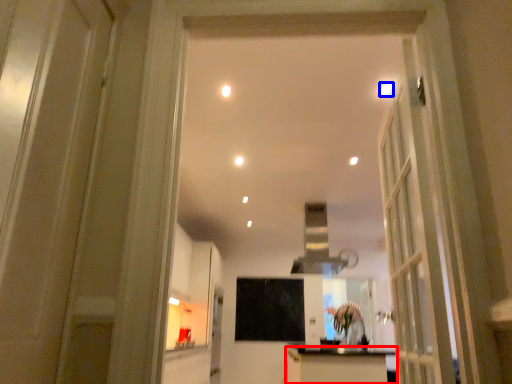
Question: Which object is further to the camera taking this photo, cabinetry (highlighted by a red box) or lighting (highlighted by a blue box)?

Choices:
 (A) cabinetry
 (B) lighting

Answer: (A)